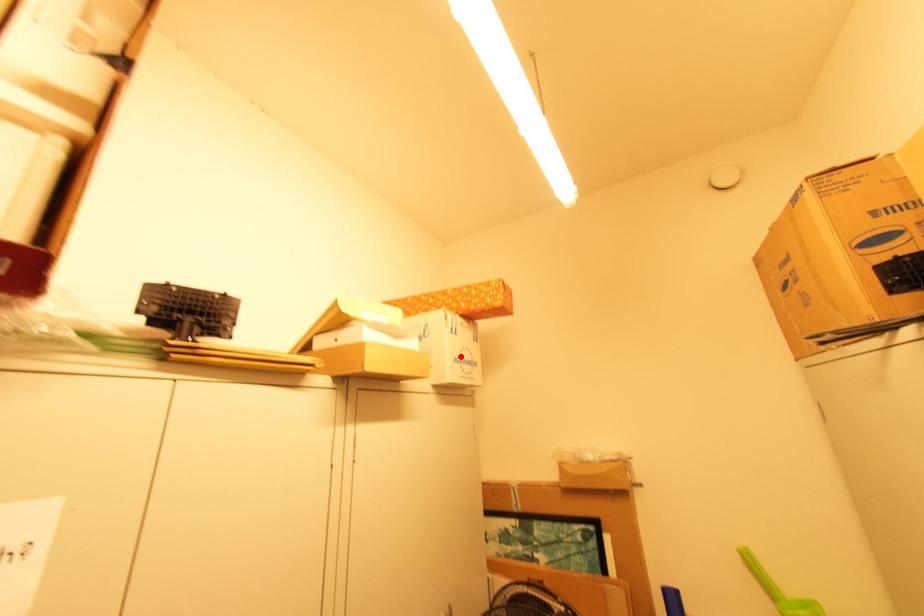
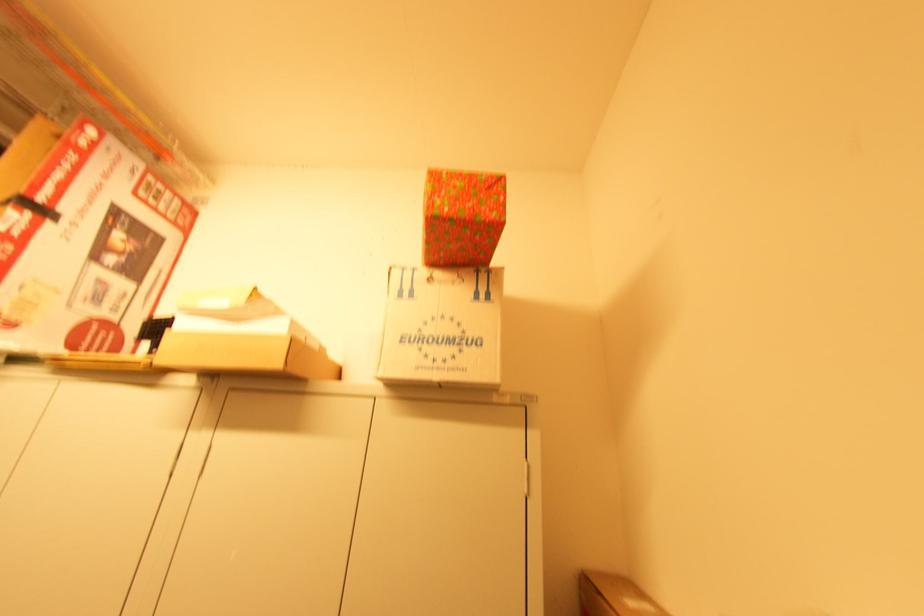
Find the pixel in the second image that matches the highlighted location in the first image.

(418, 333)